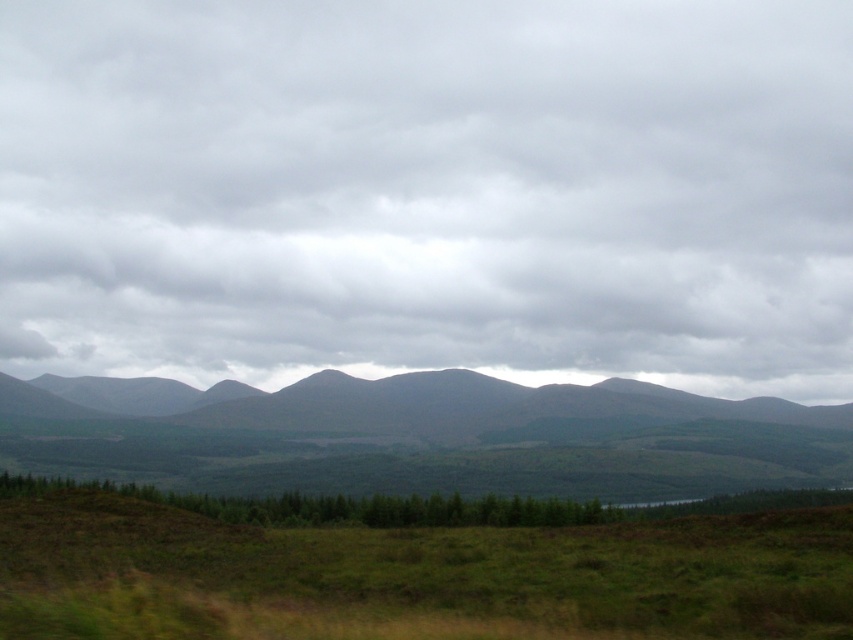
Question: From the image, what is the correct spatial relationship of cloudy gray sky at upper center in relation to green grassy field at lower center?

Choices:
 (A) below
 (B) above

Answer: (B)

Question: Can you confirm if green grassy field at lower center is bigger than gray textured mountains at center?

Choices:
 (A) no
 (B) yes

Answer: (A)

Question: Which point appears farthest from the camera in this image?

Choices:
 (A) (62, 608)
 (B) (228, 456)
 (C) (433, 92)

Answer: (C)

Question: Which point appears closest to the camera in this image?

Choices:
 (A) (325, 282)
 (B) (171, 444)

Answer: (B)

Question: Which of these objects is positioned farthest from the cloudy gray sky at upper center?

Choices:
 (A) green grassy field at lower center
 (B) gray textured mountains at center

Answer: (A)

Question: Is cloudy gray sky at upper center wider than gray textured mountains at center?

Choices:
 (A) no
 (B) yes

Answer: (B)